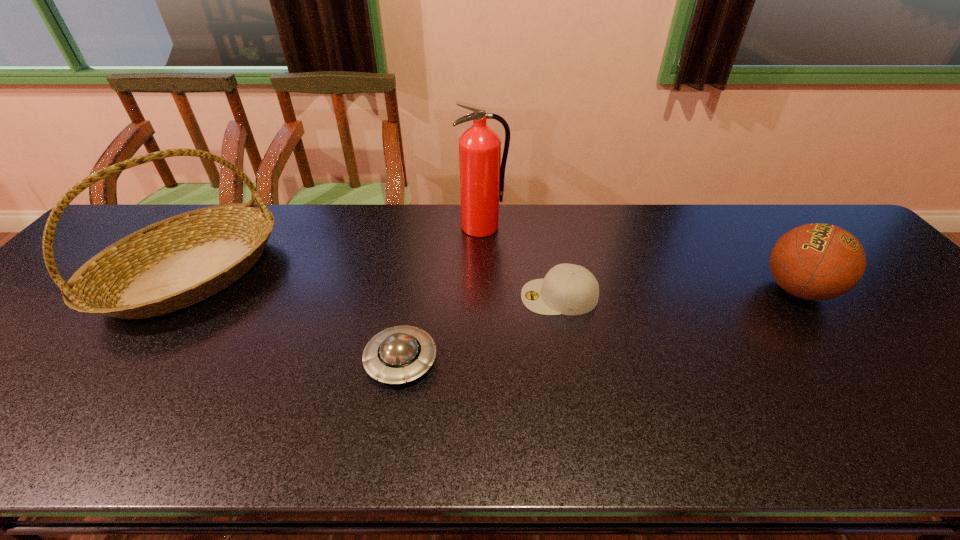
Find the location of `vacant region located 0.060m on the front-facing side of the fourth object from left to right`. vacant region located 0.060m on the front-facing side of the fourth object from left to right is located at coordinates (497, 296).

What are the coordinates of `free point located on the front-facing side of the fourth object from left to right` in the screenshot? It's located at (486, 296).

The image size is (960, 540). Find the location of `vacant space situated 0.070m on the front-facing side of the fourth object from left to right`. vacant space situated 0.070m on the front-facing side of the fourth object from left to right is located at coordinates (493, 296).

I want to click on vacant area situated 0.080m on the left of the saucer, so click(x=329, y=361).

The height and width of the screenshot is (540, 960). Identify the location of fire extinguisher at the far edge. (482, 173).

Image resolution: width=960 pixels, height=540 pixels. What are the coordinates of `basket at the far edge` in the screenshot? It's located at (177, 262).

Find the location of a particular element. The height and width of the screenshot is (540, 960). object at the left edge is located at coordinates (177, 262).

This screenshot has width=960, height=540. I want to click on object present at the far left corner, so click(x=177, y=262).

Where is `vacant space at the far edge of the desktop`? This screenshot has width=960, height=540. vacant space at the far edge of the desktop is located at coordinates (747, 209).

Image resolution: width=960 pixels, height=540 pixels. In the image, there is a desktop. Find the location of `vacant space at the near edge`. vacant space at the near edge is located at coordinates (825, 446).